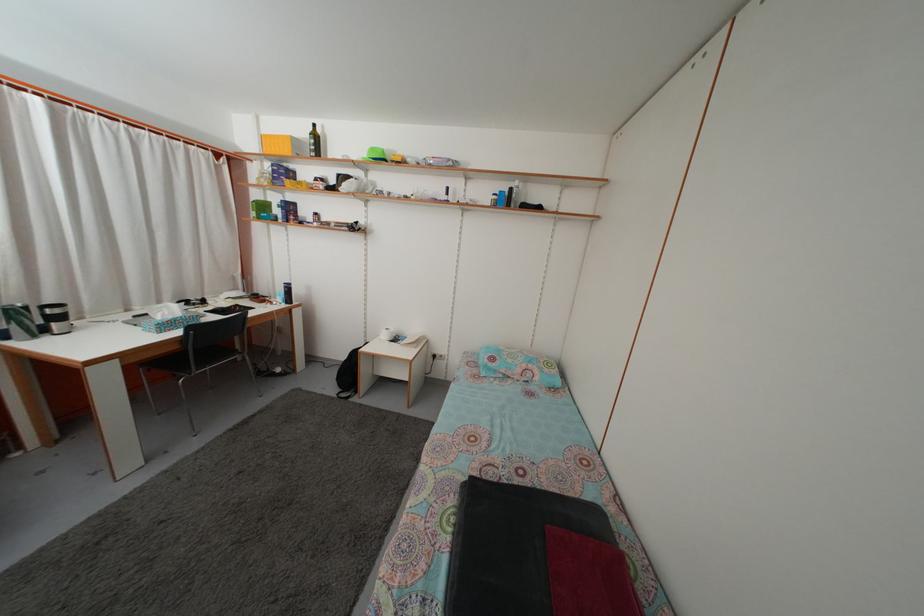
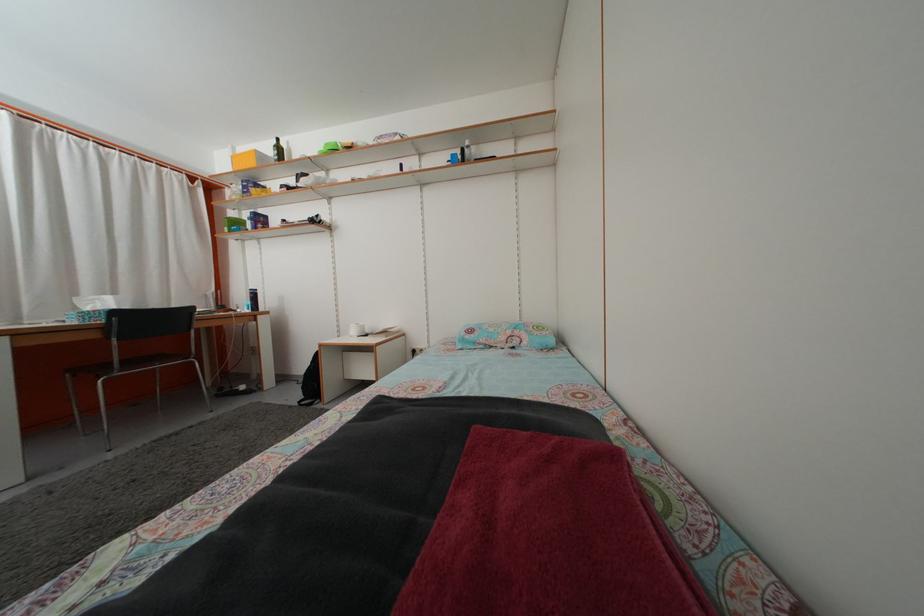
The point at (317, 136) is marked in the first image. Where is the corresponding point in the second image?

(281, 148)